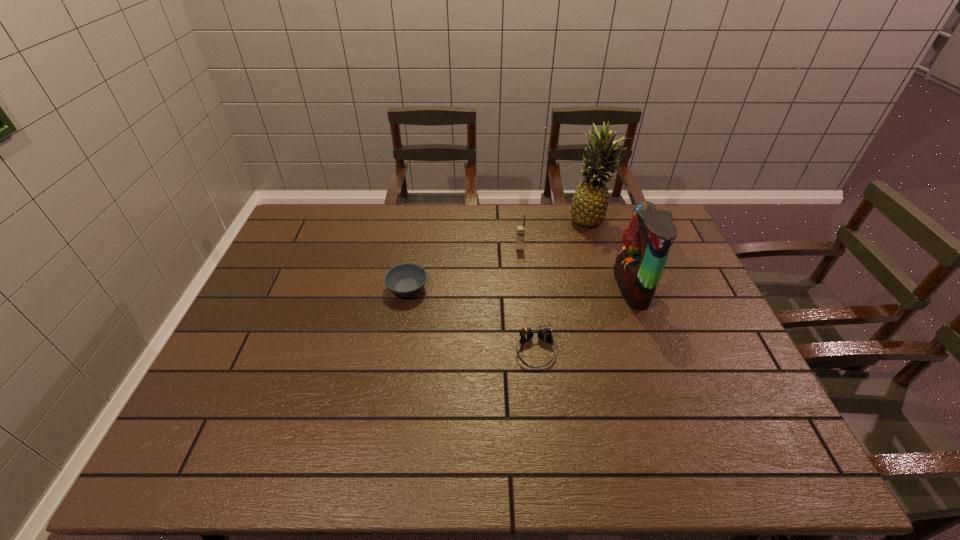
Locate an element on the screen. This screenshot has width=960, height=540. free spot located at the face of the parrot is located at coordinates (488, 287).

The height and width of the screenshot is (540, 960). I want to click on free point located 0.260m on the front of the cellular telephone, where the keypad is located, so click(526, 308).

You are a GUI agent. You are given a task and a screenshot of the screen. Output one action in this format:
    pyautogui.click(x=<x>, y=<y>)
    Task: Click on the free space located on the front of the leftmost object
    The height and width of the screenshot is (540, 960).
    Given the screenshot: What is the action you would take?
    pyautogui.click(x=400, y=330)

Identify the location of free space located through the lenses of the nearest object. The width and height of the screenshot is (960, 540). click(546, 455).

Find the location of a particular element. Image resolution: width=960 pixels, height=540 pixels. pineapple located at the far edge is located at coordinates (589, 204).

Identify the location of cellular telephone at the far edge. The height and width of the screenshot is (540, 960). (520, 229).

This screenshot has width=960, height=540. In the image, there is a desktop. What are the coordinates of `vacant space at the far edge` in the screenshot? It's located at (364, 211).

Locate an element on the screen. vacant space at the near edge of the desktop is located at coordinates (320, 457).

Identify the location of vacant region at the left edge of the desktop. (323, 248).

In the image, there is a desktop. Where is `vacant space at the right edge`? This screenshot has height=540, width=960. vacant space at the right edge is located at coordinates (697, 385).